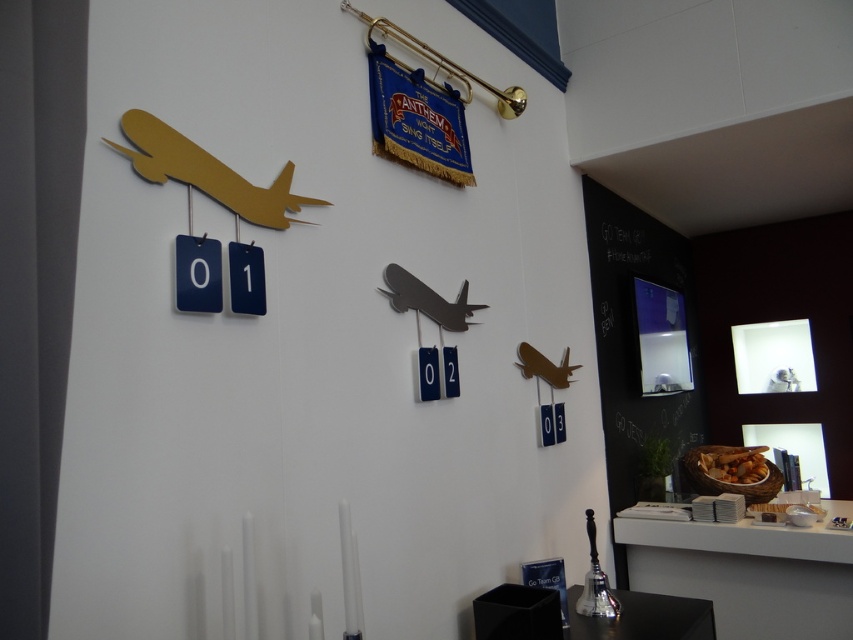
Question: Can you confirm if matte black airplane at center is bigger than metallic gold airplane at center?

Choices:
 (A) yes
 (B) no

Answer: (A)

Question: Does gold matte airplane at upper left appear on the right side of matte black airplane at center?

Choices:
 (A) yes
 (B) no

Answer: (B)

Question: Which point is farther to the camera?

Choices:
 (A) (401, 301)
 (B) (212, 182)

Answer: (A)

Question: Does gold matte airplane at upper left have a greater width compared to matte black airplane at center?

Choices:
 (A) yes
 (B) no

Answer: (B)

Question: Which object is positioned closest to the gold matte airplane at upper left?

Choices:
 (A) metallic gold airplane at center
 (B) matte black airplane at center

Answer: (B)

Question: Which is farther from the gold matte airplane at upper left?

Choices:
 (A) metallic gold airplane at center
 (B) matte black airplane at center

Answer: (A)